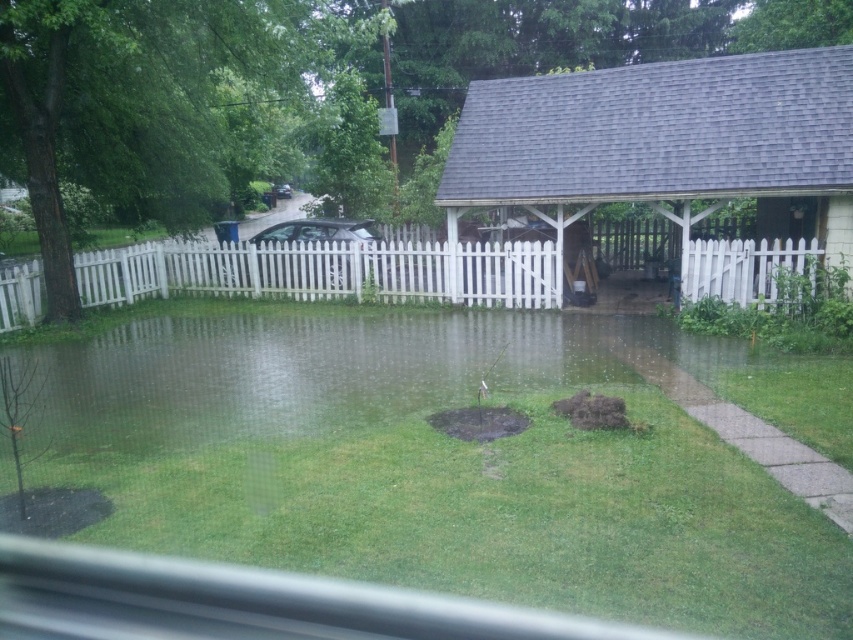
Is silver metallic car at center further to camera compared to glossy black car at center?

No, silver metallic car at center is closer to the viewer.

Which is behind, point (283, 241) or point (281, 192)?

The point (281, 192) is behind.

Locate an element on the screen. Image resolution: width=853 pixels, height=640 pixels. silver metallic car at center is located at coordinates (318, 230).

The height and width of the screenshot is (640, 853). What are the coordinates of `silver metallic car at center` in the screenshot? It's located at (318, 230).

Does gray shingled gazebo at right appear on the right side of silver metallic car at center?

Indeed, gray shingled gazebo at right is positioned on the right side of silver metallic car at center.

Between point (538, 140) and point (361, 221), which one is positioned in front?

Point (538, 140)

I want to click on gray shingled gazebo at right, so click(654, 134).

In the scene shown: Who is positioned more to the left, gray shingled gazebo at right or transparent water at center?

Positioned to the left is gray shingled gazebo at right.

How far apart are gray shingled gazebo at right and transparent water at center?

A distance of 21.60 feet exists between gray shingled gazebo at right and transparent water at center.

Which is in front, point (692, 113) or point (440, 432)?

Positioned in front is point (440, 432).

Where is `gray shingled gazebo at right`? The height and width of the screenshot is (640, 853). gray shingled gazebo at right is located at coordinates (x=654, y=134).